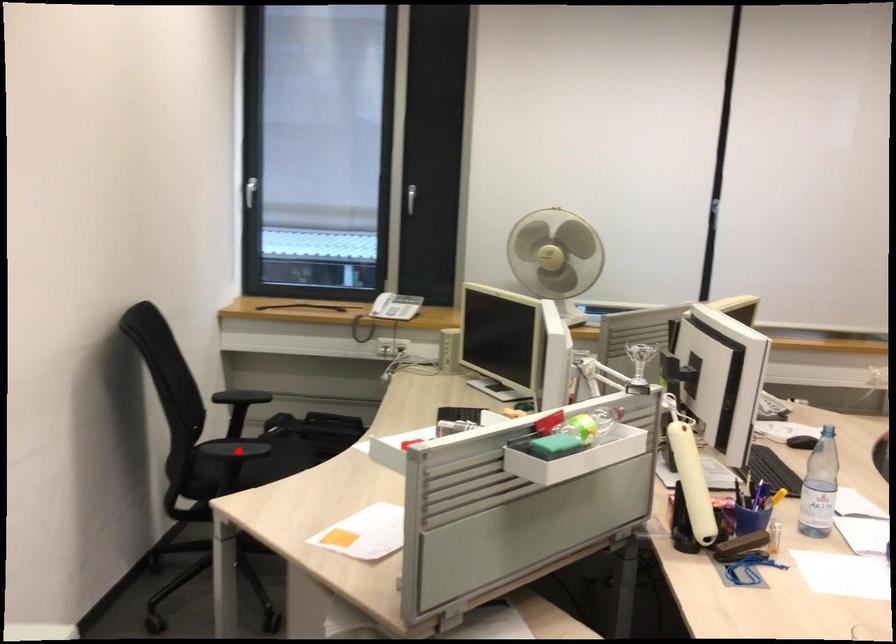
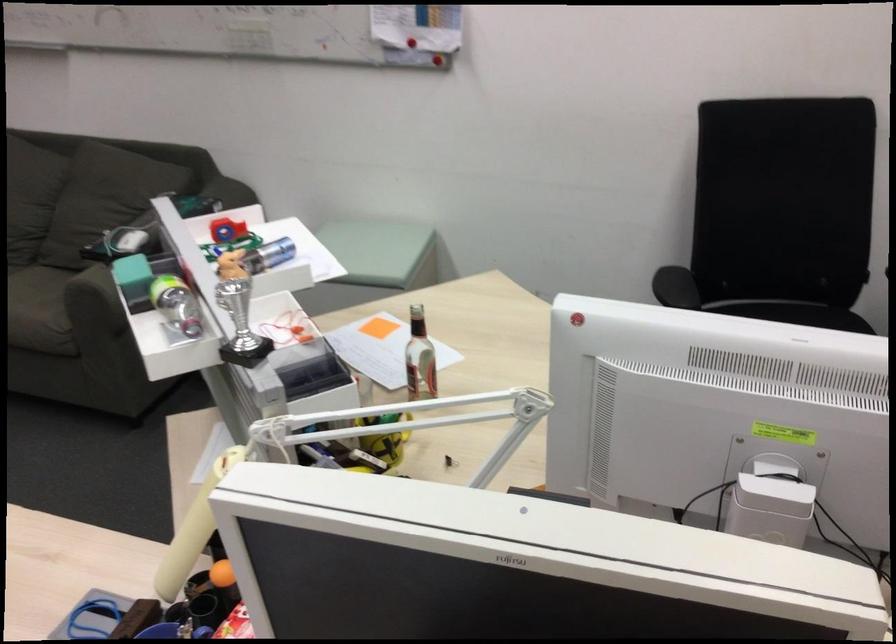
Question: A red point is marked in image1. In image2, is the corresponding 3D point closer to the camera or farther? Reply with the corresponding letter.

Choices:
 (A) The corresponding 3D point is closer.
 (B) The corresponding 3D point is farther.

Answer: (A)